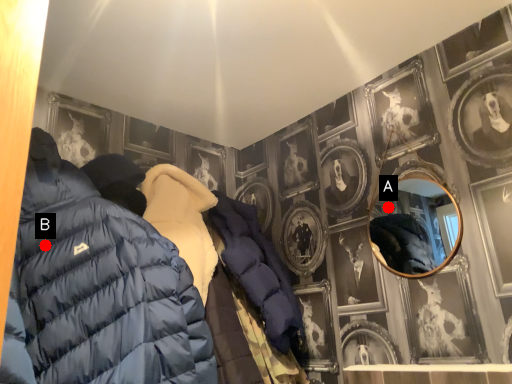
Question: Two points are circled on the image, labeled by A and B beside each circle. Which point is closer to the camera?

Choices:
 (A) A is closer
 (B) B is closer

Answer: (B)